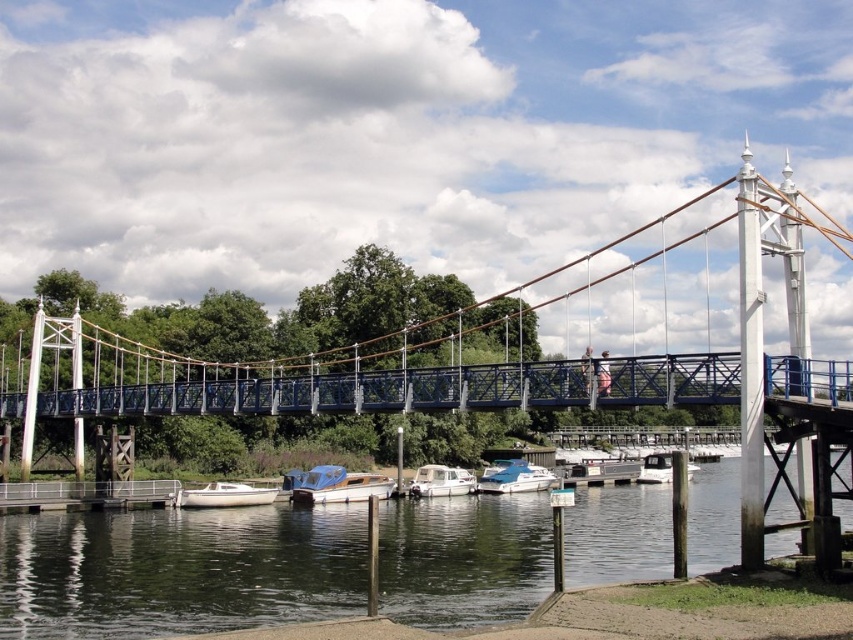
Looking at this image, you are planning to load a cargo container that is 3 meters wide onto a boat. You see the blue glossy boat at center and the white glossy boat at lower center. Which boat can accommodate the cargo container based on their widths?

The white glossy boat at lower center can accommodate the cargo container since its width is greater than the blue glossy boat at center, which is narrower and may not fit the 3 meter wide container.

You are standing on the suspension bridge and want to know the position of the blue glossy boat at center relative to the bridge. Is it directly below the bridge, to the left, or to the right?

The blue glossy boat at center is located at point coordinates that are not specified in the scene description. However, based on the provided information, the boat is at the center of the image, so it is likely positioned directly below the suspension bridge.

You are standing on the metallic dock at lower left and want to reach the white glossy boat at center. Which direction should you move to get there?

You should move to the right because the metallic dock at lower left is to the left of the white glossy boat at center, so moving right will bring you closer to the boat.